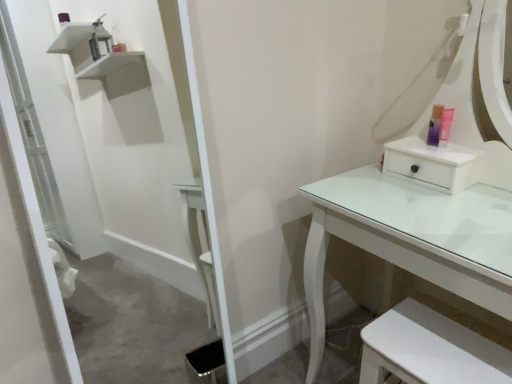
Question: Is translucent plastic container at upper right outside of white glossy step stool at lower right?

Choices:
 (A) yes
 (B) no

Answer: (A)

Question: Considering the relative sizes of translucent plastic container at upper right and white glossy step stool at lower right in the image provided, is translucent plastic container at upper right smaller than white glossy step stool at lower right?

Choices:
 (A) yes
 (B) no

Answer: (A)

Question: Can you confirm if translucent plastic container at upper right is bigger than white glossy step stool at lower right?

Choices:
 (A) yes
 (B) no

Answer: (B)

Question: Is translucent plastic container at upper right at the left side of white glossy step stool at lower right?

Choices:
 (A) yes
 (B) no

Answer: (B)

Question: Is translucent plastic container at upper right turned away from white glossy step stool at lower right?

Choices:
 (A) no
 (B) yes

Answer: (A)

Question: Does translucent plastic container at upper right lie behind white glossy step stool at lower right?

Choices:
 (A) no
 (B) yes

Answer: (B)

Question: Considering the relative sizes of white glossy step stool at lower right and translucent plastic container at upper right in the image provided, is white glossy step stool at lower right wider than translucent plastic container at upper right?

Choices:
 (A) yes
 (B) no

Answer: (A)

Question: Is the depth of white glossy step stool at lower right greater than that of translucent plastic container at upper right?

Choices:
 (A) no
 (B) yes

Answer: (A)

Question: Is translucent plastic container at upper right at the back of white glossy step stool at lower right?

Choices:
 (A) no
 (B) yes

Answer: (A)

Question: Can you confirm if white glossy step stool at lower right is positioned to the right of translucent plastic container at upper right?

Choices:
 (A) no
 (B) yes

Answer: (A)

Question: From the image's perspective, would you say white glossy step stool at lower right is shown under translucent plastic container at upper right?

Choices:
 (A) no
 (B) yes

Answer: (B)

Question: Are white glossy step stool at lower right and translucent plastic container at upper right beside each other?

Choices:
 (A) no
 (B) yes

Answer: (A)

Question: Considering the positions of white glossy step stool at lower right and translucent plastic container at upper right in the image, is white glossy step stool at lower right taller or shorter than translucent plastic container at upper right?

Choices:
 (A) tall
 (B) short

Answer: (A)